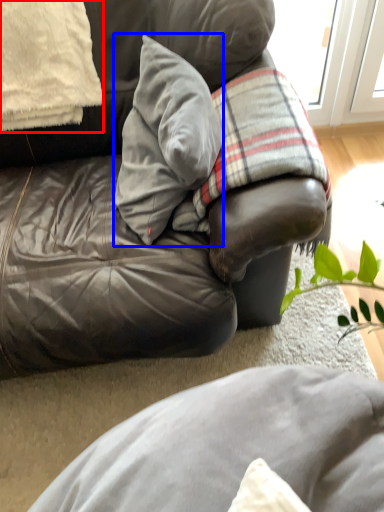
Question: Which object is closer to the camera taking this photo, pillow (highlighted by a red box) or pillow (highlighted by a blue box)?

Choices:
 (A) pillow
 (B) pillow

Answer: (B)